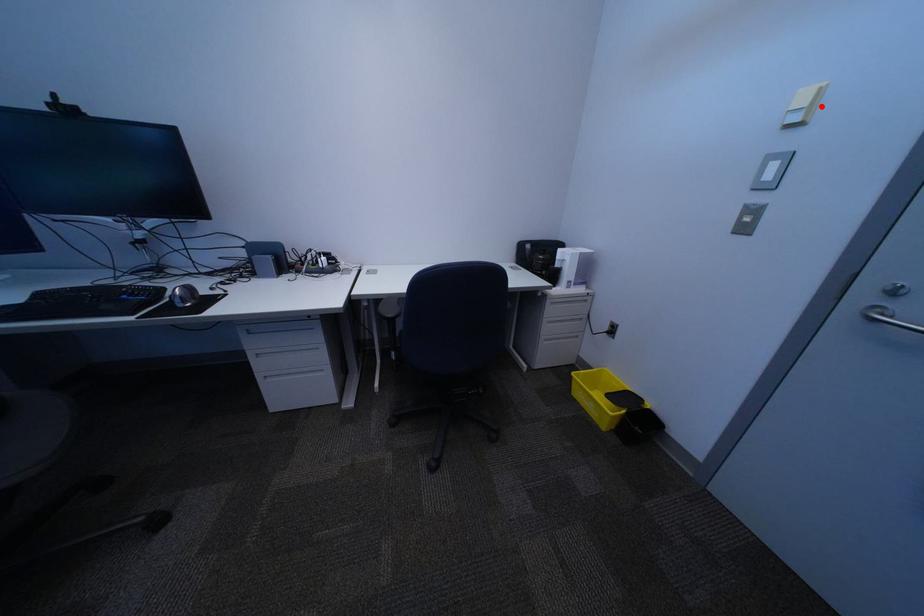
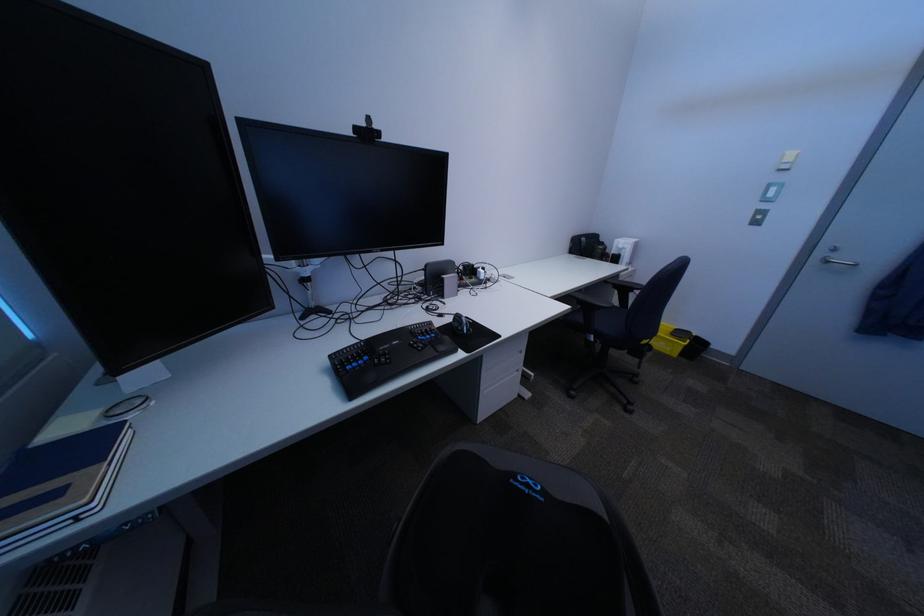
Locate, in the second image, the point that corresponds to the highlighted location in the first image.

(807, 163)